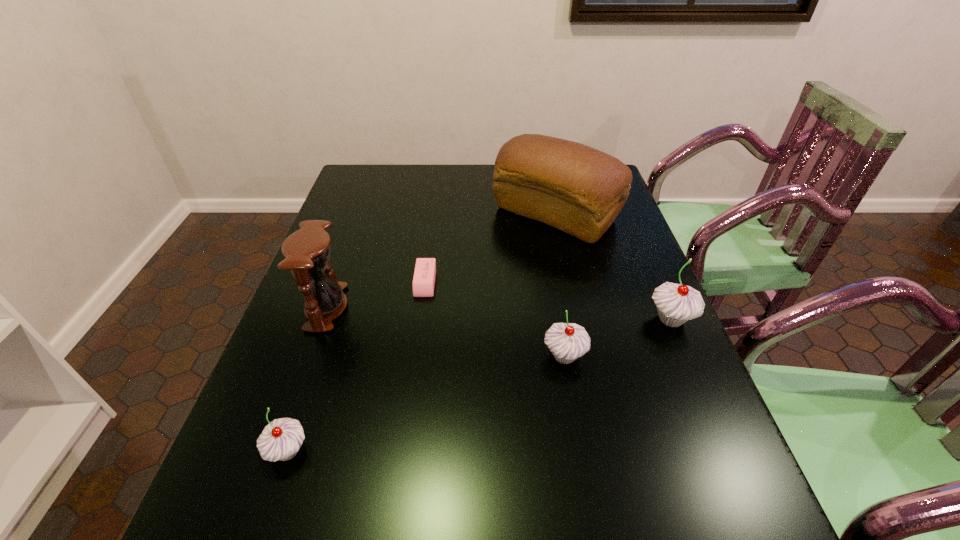
The image size is (960, 540). I want to click on unoccupied position between the rightmost cupcake and the fifth shortest object, so click(x=498, y=313).

Find the location of a particular element. Image resolution: width=960 pixels, height=540 pixels. vacant point located between the rightmost cupcake and the fourth object from right to left is located at coordinates (548, 301).

Where is `free space between the farthest cupcake and the fourth object from right to left`? Image resolution: width=960 pixels, height=540 pixels. free space between the farthest cupcake and the fourth object from right to left is located at coordinates (548, 301).

You are a GUI agent. You are given a task and a screenshot of the screen. Output one action in this format:
    pyautogui.click(x=<x>, y=<y>)
    Task: Click on the vacant space that's between the eraser and the farthest object
    
    Given the screenshot: What is the action you would take?
    pyautogui.click(x=491, y=248)

I want to click on vacant area that lies between the eraser and the second shortest cupcake, so click(494, 319).

At what (x,y) coordinates should I click in order to perform the action: click on free space between the hourglass and the leftmost cupcake. Please return your answer as a coordinate pair (x, y). Looking at the image, I should click on (307, 379).

Image resolution: width=960 pixels, height=540 pixels. In order to click on vacant region between the farthest object and the eraser in this screenshot , I will do `click(491, 248)`.

Find the location of a particular element. Image resolution: width=960 pixels, height=540 pixels. object that stands as the second closest to the second nearest cupcake is located at coordinates (423, 283).

Identify which object is the fifth closest to the bread. Please provide its 2D coordinates. Your answer should be formatted as a tuple, i.e. [(x, y)], where the tuple contains the x and y coordinates of a point satisfying the conditions above.

[(281, 439)]

The height and width of the screenshot is (540, 960). I want to click on cupcake that is the third closest to the hourglass, so click(x=676, y=304).